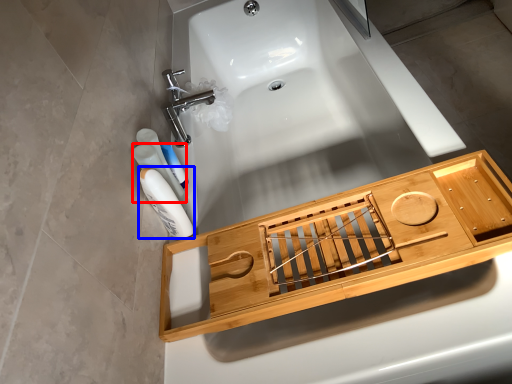
Question: Which object is further to the camera taking this photo, mouthwash (highlighted by a red box) or mouthwash (highlighted by a blue box)?

Choices:
 (A) mouthwash
 (B) mouthwash

Answer: (A)